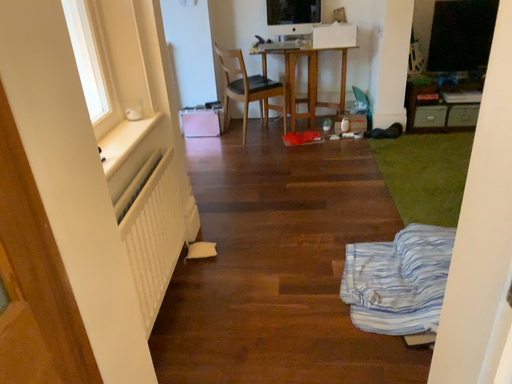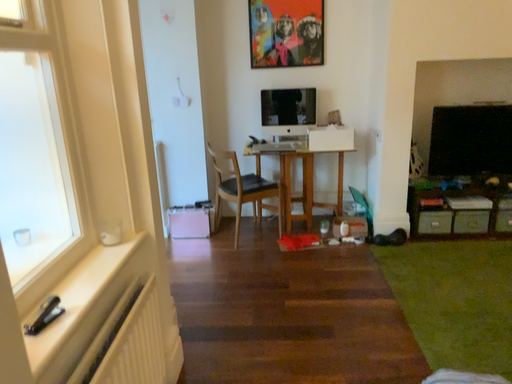
Question: How did the camera likely rotate when shooting the video?

Choices:
 (A) rotated upward
 (B) rotated downward

Answer: (A)